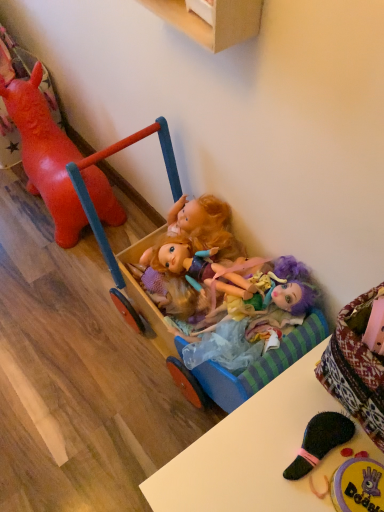
Image resolution: width=384 pixels, height=512 pixels. I want to click on free space to the left of wooden toy carriage at center, so click(59, 348).